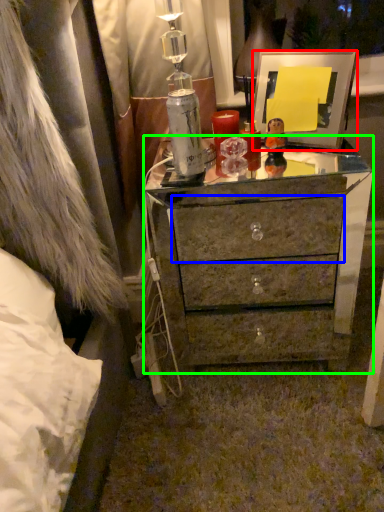
Question: Which is nearer to the picture frame (highlighted by a red box)? drawer (highlighted by a blue box) or chest of drawers (highlighted by a green box).

Choices:
 (A) drawer
 (B) chest of drawers

Answer: (B)